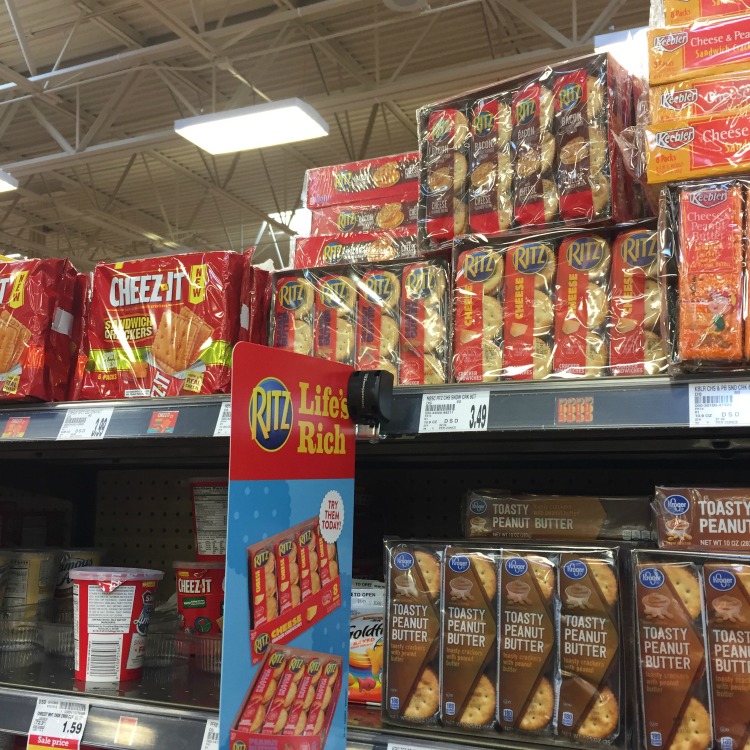
Find the location of a particular element. shelf price tag is located at coordinates (88, 424), (470, 417), (722, 408), (225, 421), (58, 730), (207, 736).